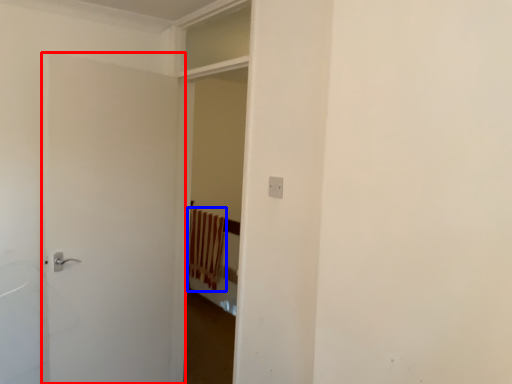
Question: Which object is closer to the camera taking this photo, door (highlighted by a red box) or curtain (highlighted by a blue box)?

Choices:
 (A) door
 (B) curtain

Answer: (A)